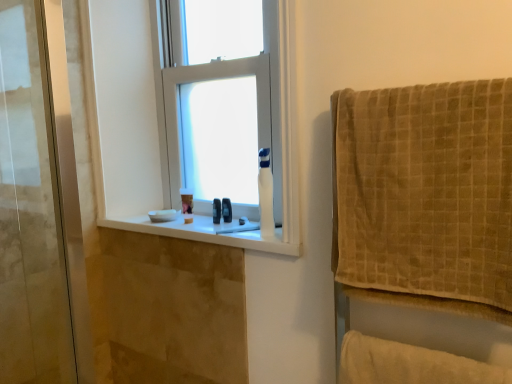
You are a GUI agent. You are given a task and a screenshot of the screen. Output one action in this format:
    pyautogui.click(x=<x>, y=<y>)
    Task: Click on the beige soft towel at lower right
    
    Given the screenshot: What is the action you would take?
    pyautogui.click(x=410, y=364)

Find the location of a particular element. beige textured towel at right is located at coordinates (425, 190).

Measure the distance between point (450, 119) and camera.

The depth of point (450, 119) is 37.01 inches.

Locate an element on the screen. This screenshot has width=512, height=384. white glossy window sill at center is located at coordinates (214, 232).

Find the location of a particular element. window sill directly beneath the black rubber ring at window (from a real-world perspective) is located at coordinates (214, 232).

Is white glossy window sill at center turned away from black rubber ring at window?

white glossy window sill at center is not turned away from black rubber ring at window.

Does white glossy window sill at center have a lesser width compared to black rubber ring at window?

Incorrect, the width of white glossy window sill at center is not less than that of black rubber ring at window.

From the image's perspective, who appears lower, white glossy window sill at center or black rubber ring at window?

white glossy window sill at center is shown below in the image.

From the image's perspective, would you say black rubber ring at window is positioned over beige soft towel at lower right?

Indeed, from the image's perspective, black rubber ring at window is shown above beige soft towel at lower right.

Does point (213, 206) come in front of point (369, 346)?

No, it is behind (369, 346).

From a real-world perspective, is black rubber ring at window on beige soft towel at lower right?

Correct, in the physical world, black rubber ring at window is higher than beige soft towel at lower right.

Is black rubber ring at window turned away from beige soft towel at lower right?

No, black rubber ring at window's orientation is not away from beige soft towel at lower right.

From a real-world perspective, between black rubber ring at window and white glossy toilet paper at center, who is vertically higher?

From a 3D spatial view, white glossy toilet paper at center is above.

Which is behind, point (214, 212) or point (269, 222)?

The point (214, 212) is behind.

From the image's perspective, which one is positioned higher, black rubber ring at window or white glossy toilet paper at center?

white glossy toilet paper at center is shown above in the image.

Which object is positioned more to the left, black rubber ring at window or white glossy toilet paper at center?

black rubber ring at window is more to the left.

From the picture: Considering the sizes of objects beige soft towel at lower right and beige textured towel at right in the image provided, who is taller, beige soft towel at lower right or beige textured towel at right?

beige textured towel at right is taller.

Looking at this image, which object is closer to the camera, beige soft towel at lower right or beige textured towel at right?

Positioned in front is beige textured towel at right.

Between beige soft towel at lower right and beige textured towel at right, which one has larger size?

beige textured towel at right is bigger.

Identify the location of toilet paper on the right of the white plastic window at center. 265,195.

Can white plastic window at center be found inside white glossy toilet paper at center?

No.

Measure the distance between white glossy toilet paper at center and white plastic window at center.

27.27 centimeters.

Between white glossy toilet paper at center and white plastic window at center, which one has less height?

white glossy toilet paper at center is shorter.

Considering the sizes of objects black rubber ring at window and white plastic window at center in the image provided, who is taller, black rubber ring at window or white plastic window at center?

Standing taller between the two is white plastic window at center.

Who is smaller, black rubber ring at window or white plastic window at center?

With smaller size is black rubber ring at window.

Based on the photo, is black rubber ring at window to the left of white plastic window at center from the viewer's perspective?

No, black rubber ring at window is not to the left of white plastic window at center.

Find the location of `window to the left of black rubber ring at window`. window to the left of black rubber ring at window is located at coordinates (223, 124).

Is black rubber ring at window surrounding white glossy window sill at center?

Definitely not — white glossy window sill at center is not inside black rubber ring at window.

Between black rubber ring at window and white glossy window sill at center, which one has less height?

With less height is white glossy window sill at center.

Based on the photo, from a real-world perspective, is black rubber ring at window positioned under white glossy window sill at center based on gravity?

No, from a real-world perspective, black rubber ring at window is not beneath white glossy window sill at center.

Is black rubber ring at window far from white glossy window sill at center?

black rubber ring at window is near white glossy window sill at center, not far away.

This screenshot has width=512, height=384. Find the location of `toiletry above the white glossy window sill at center (from the image's perspective)`. toiletry above the white glossy window sill at center (from the image's perspective) is located at coordinates coord(216,211).

This screenshot has width=512, height=384. In order to click on toiletry behind the beige soft towel at lower right in this screenshot , I will do `click(216, 211)`.

When comparing their distances from white glossy window sill at center, does white plastic window at center or beige textured towel at right seem closer?

The object closer to white glossy window sill at center is white plastic window at center.

From the image, which object appears to be nearer to beige textured towel at right, white plastic window at center or white glossy window sill at center?

white glossy window sill at center lies closer to beige textured towel at right than the other object.

Consider the image. Estimate the real-world distances between objects in this image. Which object is closer to white plastic window at center, white glossy window sill at center or black rubber ring at window?

Among the two, white glossy window sill at center is located nearer to white plastic window at center.

Estimate the real-world distances between objects in this image. Which object is closer to black rubber ring at window, beige soft towel at lower right or beige textured towel at right?

The object closer to black rubber ring at window is beige soft towel at lower right.

From the picture: Estimate the real-world distances between objects in this image. Which object is closer to white plastic window at center, beige soft towel at lower right or beige textured towel at right?

beige textured towel at right is positioned closer to the anchor white plastic window at center.

Which object lies further to the anchor point white glossy window sill at center, white glossy toilet paper at center or white plastic window at center?

The object further to white glossy window sill at center is white plastic window at center.

Estimate the real-world distances between objects in this image. Which object is further from white glossy window sill at center, black rubber ring at window or white glossy toilet paper at center?

The object further to white glossy window sill at center is black rubber ring at window.

From the image, which object appears to be farther from white glossy window sill at center, white plastic window at center or black rubber ring at window?

white plastic window at center is positioned further to the anchor white glossy window sill at center.

Where is `window located between beige textured towel at right and black rubber ring at window in the depth direction`? window located between beige textured towel at right and black rubber ring at window in the depth direction is located at coordinates click(223, 124).

This screenshot has height=384, width=512. Identify the location of toilet paper between white glossy window sill at center and beige soft towel at lower right from left to right. (265, 195).

Locate an element on the screen. This screenshot has width=512, height=384. toilet paper located between beige textured towel at right and white plastic window at center in the depth direction is located at coordinates (265, 195).

Locate an element on the screen. window sill between beige textured towel at right and black rubber ring at window from front to back is located at coordinates (214, 232).